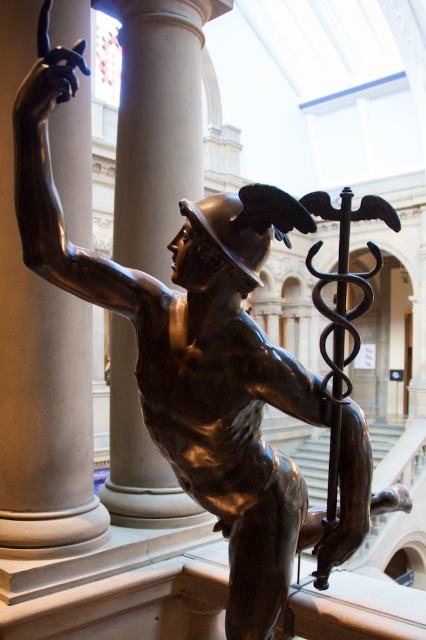
Question: Can you confirm if matte gray column at left is positioned to the right of smooth white column at center?

Choices:
 (A) yes
 (B) no

Answer: (B)

Question: Is matte gray column at left smaller than smooth white column at center?

Choices:
 (A) yes
 (B) no

Answer: (A)

Question: Which of the following is the closest to the observer?

Choices:
 (A) (28, 180)
 (B) (120, 518)

Answer: (A)

Question: Does matte gray column at left appear under smooth white column at center?

Choices:
 (A) no
 (B) yes

Answer: (B)

Question: Which object appears closest to the camera in this image?

Choices:
 (A) matte gray column at left
 (B) smooth white column at center

Answer: (A)